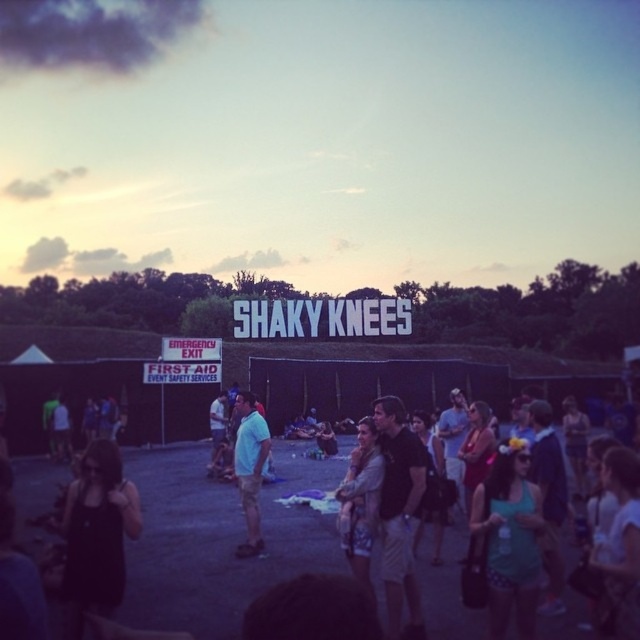
You are standing at the point labeled point (532, 570) at Shaky Knees music festival. You want to take a photo of the large illuminated Shaky Knees sign in the background. Considering your current position, will you be able to capture the entire sign in your camera frame without moving? Explain your reasoning.

The point labeled point (532, 570) is 69.27 meters away from the viewer. Since the Shaky Knees sign is in the background and the distance is quite large, it is likely that the entire sign can be captured in the camera frame without needing to move, as most cameras have wide enough angles to include distant background elements at that distance.

You are a photographer at the Shaky Knees music festival. You notice two people in the crowd wearing a teal fabric dress at center and a matte blue shirt at center. Which person should you approach if you want to capture someone wearing a smaller clothing item?

The teal fabric dress at center has a smaller size compared to the matte blue shirt at center, so you should approach the person wearing the teal fabric dress at center.

You are a photographer at the Shaky Knees festival. You want to take a photo of the teal fabric dress at center from your current position. The camera you are using has a maximum focus range of 200 feet. Will you be able to capture the dress clearly with this camera?

→ The teal fabric dress at center and camera are 218.09 feet apart from each other. Since the maximum focus range is 200 feet, the camera cannot focus on the dress clearly at this distance.